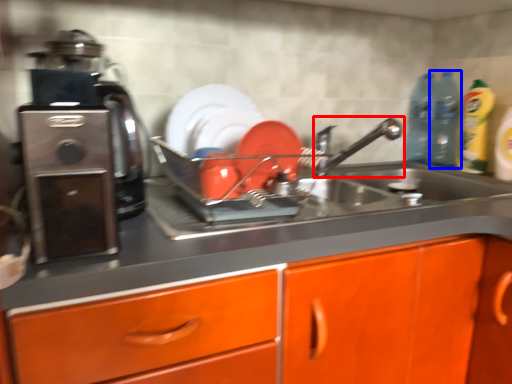
Question: Among these objects, which one is farthest to the camera, tap (highlighted by a red box) or bottle (highlighted by a blue box)?

Choices:
 (A) tap
 (B) bottle

Answer: (B)